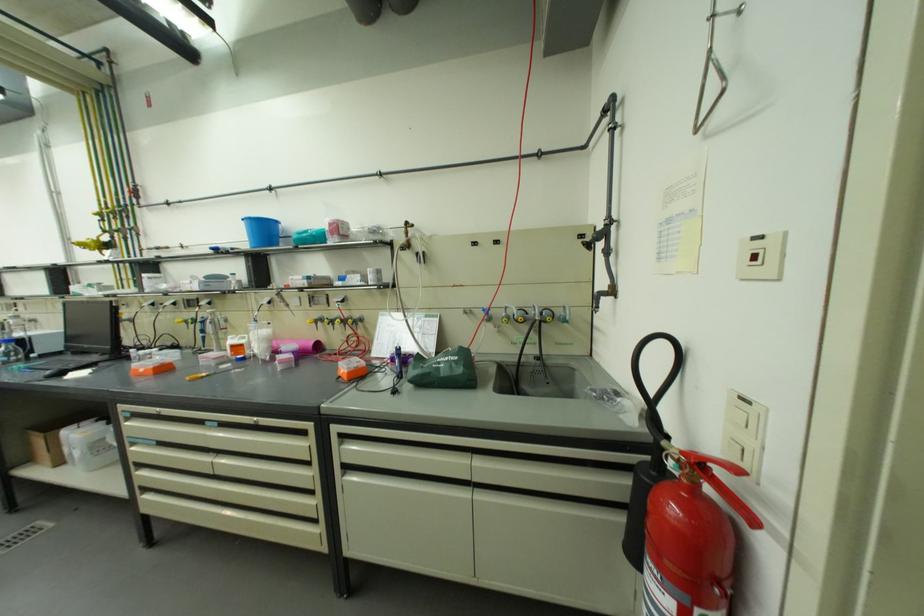
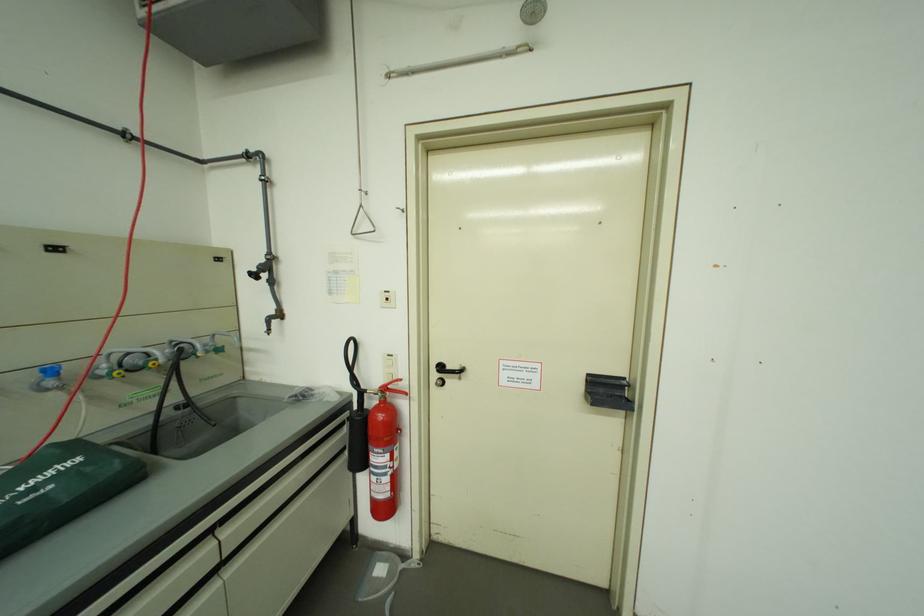
In the second image, find the point that corresponds to [743,440] in the first image.

(397, 375)